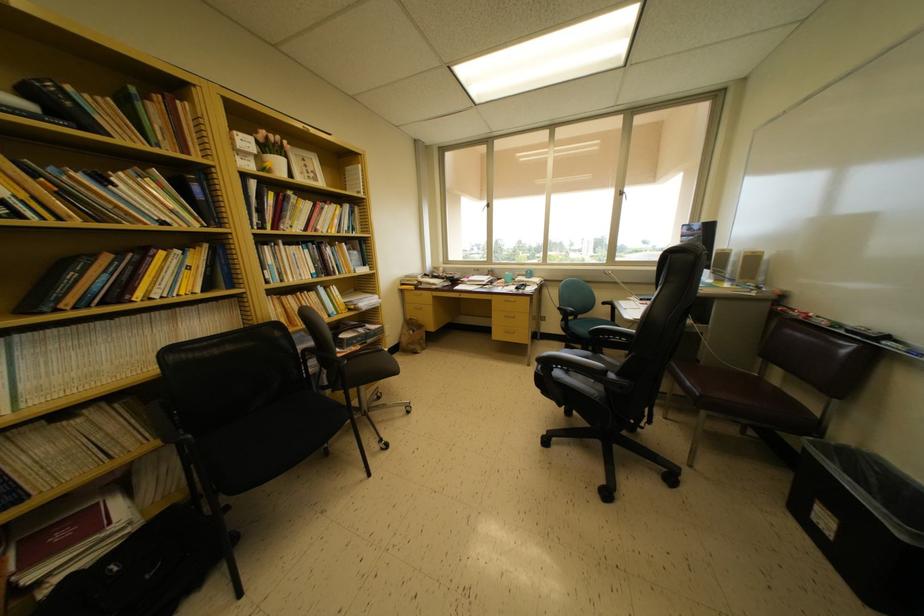
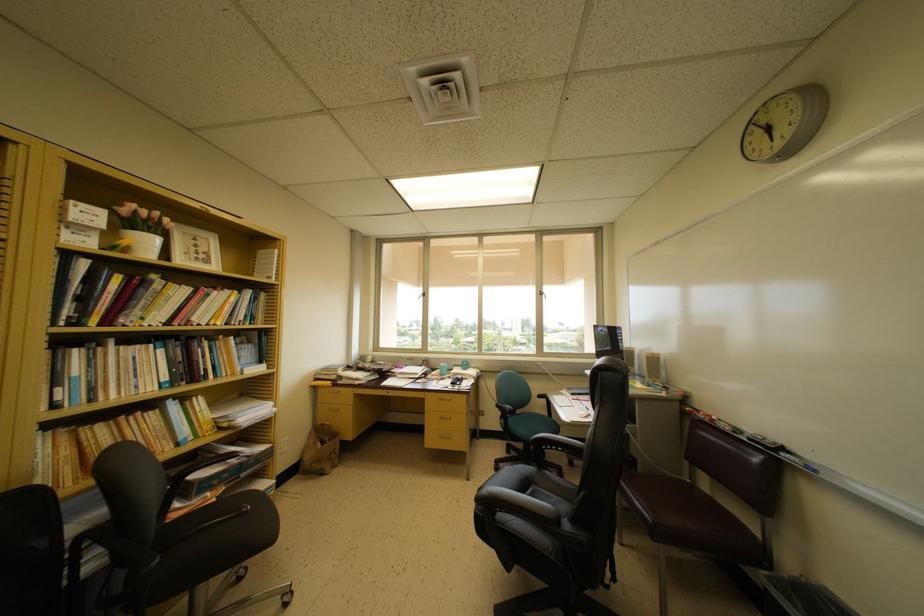
Where in the second image is the point corresponding to the point at 324,310 from the first image?

(168, 437)